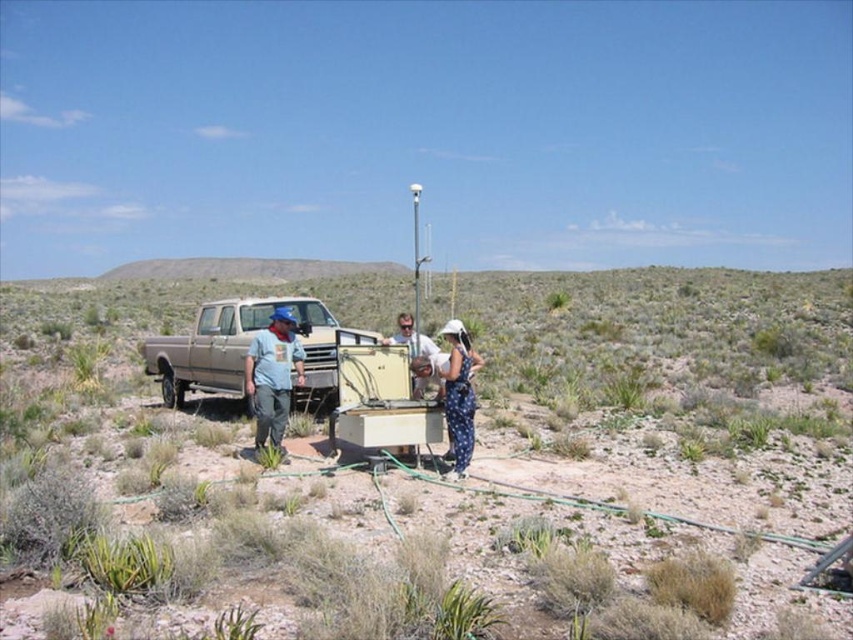
Question: Which of the following is the farthest from the observer?

Choices:
 (A) (792, 577)
 (B) (280, 406)
 (C) (467, 408)
 (D) (209, 321)

Answer: (D)

Question: Is dirt field at center smaller than matte white shirt at center?

Choices:
 (A) no
 (B) yes

Answer: (A)

Question: Does brown matte truck at center lie in front of blue dotted dress at center?

Choices:
 (A) yes
 (B) no

Answer: (B)

Question: Which point appears farthest from the camera in this image?

Choices:
 (A) (302, 346)
 (B) (270, 390)

Answer: (A)

Question: Among these points, which one is nearest to the camera?

Choices:
 (A) (238, 317)
 (B) (409, 317)

Answer: (B)

Question: Considering the relative positions of dirt field at center and blue dotted dress at center in the image provided, where is dirt field at center located with respect to blue dotted dress at center?

Choices:
 (A) left
 (B) right

Answer: (A)